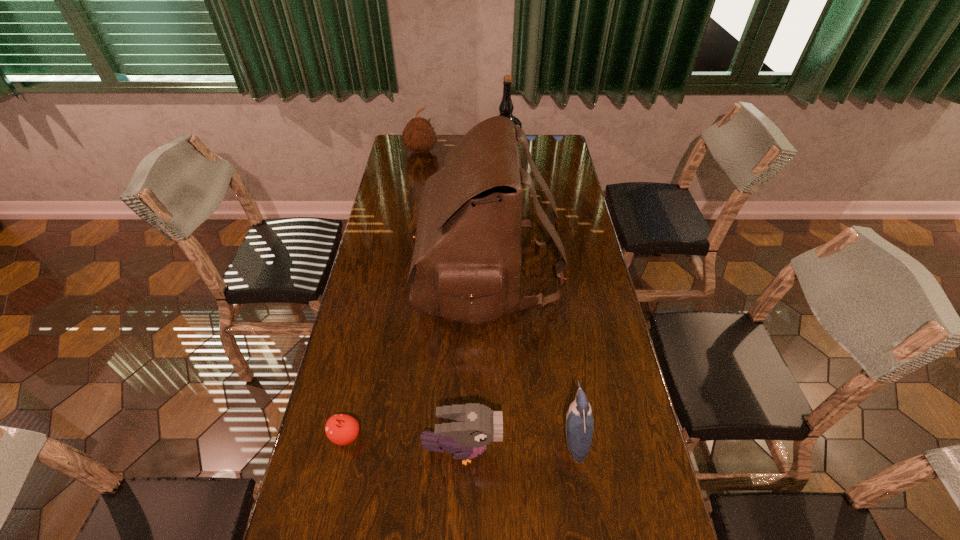
Where is `free space located 0.400m on the front of the wine bottle`? The width and height of the screenshot is (960, 540). free space located 0.400m on the front of the wine bottle is located at coordinates (509, 232).

Identify the location of vacant area situated 0.380m on the surface of the third tallest object. Image resolution: width=960 pixels, height=540 pixels. (410, 213).

Find the location of `vacant space located 0.080m at the beak of the left bird`. vacant space located 0.080m at the beak of the left bird is located at coordinates (533, 450).

Where is `free space located 0.330m at the tip of the right bird's beak`? The image size is (960, 540). free space located 0.330m at the tip of the right bird's beak is located at coordinates (430, 437).

You are a GUI agent. You are given a task and a screenshot of the screen. Output one action in this format:
    pyautogui.click(x=<x>, y=<y>)
    Task: Click on the free space located at the tip of the right bird's beak
    Image resolution: width=960 pixels, height=540 pixels.
    Given the screenshot: What is the action you would take?
    pyautogui.click(x=486, y=437)

The image size is (960, 540). Identify the location of free space located at the tip of the right bird's beak. (446, 437).

The height and width of the screenshot is (540, 960). I want to click on vacant space located 0.230m on the right of the apple, so click(453, 436).

Where is `wine bottle positioned at the far edge`? This screenshot has height=540, width=960. wine bottle positioned at the far edge is located at coordinates (506, 107).

You are a GUI agent. You are given a task and a screenshot of the screen. Output one action in this format:
    pyautogui.click(x=<x>, y=<y>)
    Task: Click on the coconut that is at the far edge
    The image size is (960, 540).
    Given the screenshot: What is the action you would take?
    pyautogui.click(x=419, y=136)

The width and height of the screenshot is (960, 540). I want to click on coconut located in the left edge section of the desktop, so click(x=419, y=136).